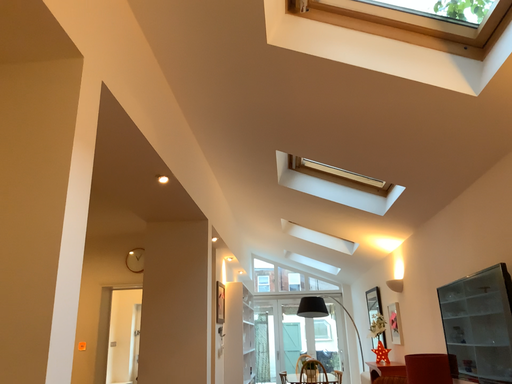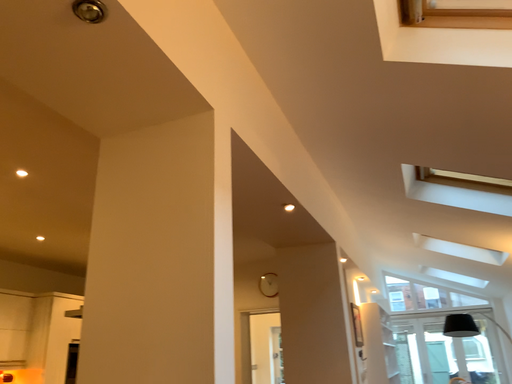
Question: How did the camera likely rotate when shooting the video?

Choices:
 (A) rotated left
 (B) rotated right

Answer: (A)